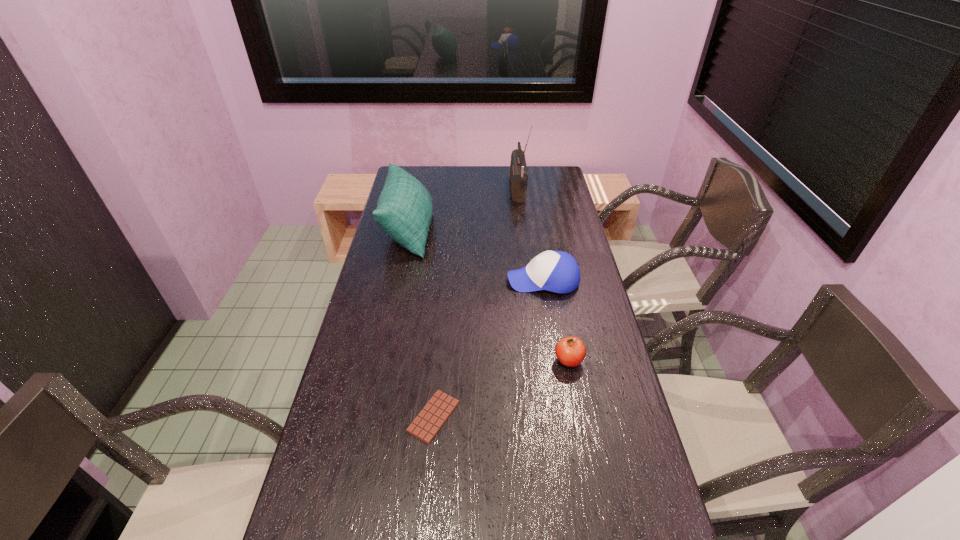
At what (x,y) coordinates should I click in order to perform the action: click on the farthest object. Please return your answer as a coordinate pair (x, y). The height and width of the screenshot is (540, 960). Looking at the image, I should click on (518, 169).

Find the location of a particular element. radio receiver is located at coordinates (518, 169).

Identify the location of cushion. The width and height of the screenshot is (960, 540). (404, 210).

Where is `the second tallest object`? the second tallest object is located at coordinates (404, 210).

I want to click on apple, so click(570, 351).

Locate an element on the screen. baseball cap is located at coordinates (557, 271).

At what (x,y) coordinates should I click in order to perform the action: click on the nearest object. Please return your answer as a coordinate pair (x, y). The width and height of the screenshot is (960, 540). Looking at the image, I should click on (426, 425).

Locate an element on the screen. This screenshot has width=960, height=540. the shortest object is located at coordinates (426, 425).

Where is `free space located on the front-facing side of the radio receiver`? free space located on the front-facing side of the radio receiver is located at coordinates (428, 190).

This screenshot has height=540, width=960. Find the location of `blank area located 0.180m on the front-facing side of the radio receiver`. blank area located 0.180m on the front-facing side of the radio receiver is located at coordinates (470, 190).